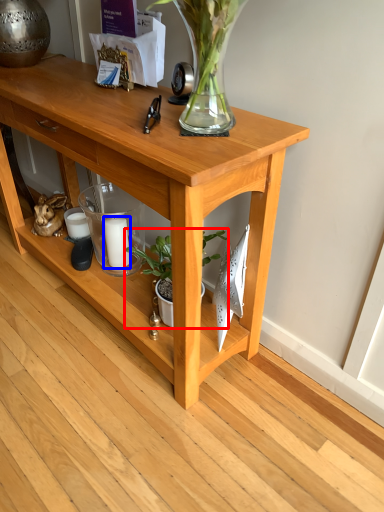
Question: Among these objects, which one is farthest to the camera, houseplant (highlighted by a red box) or candle (highlighted by a blue box)?

Choices:
 (A) houseplant
 (B) candle

Answer: (B)